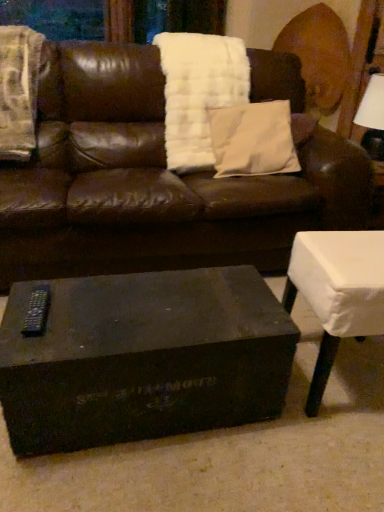
Question: Is matte black coffee table at center wider or thinner than white cloth-covered table at lower right?

Choices:
 (A) thin
 (B) wide

Answer: (A)

Question: Is matte black coffee table at center bigger or smaller than white cloth-covered table at lower right?

Choices:
 (A) big
 (B) small

Answer: (A)

Question: Which object is positioned closest to the white cloth-covered table at lower right?

Choices:
 (A) matte black coffee table at center
 (B) brown leather couch at center
 (C) black plastic remote at lower left
 (D) white fuzzy blanket at left, marked as the 1th blanket in a left-to-right arrangement
 (E) white fabric lampshade at upper right

Answer: (A)

Question: Which of these objects is positioned farthest from the white fabric lampshade at upper right?

Choices:
 (A) brown leather couch at center
 (B) matte black coffee table at center
 (C) white cloth-covered table at lower right
 (D) white fuzzy blanket at left, the 2th blanket positioned from the right
 (E) white soft pillow at center

Answer: (B)